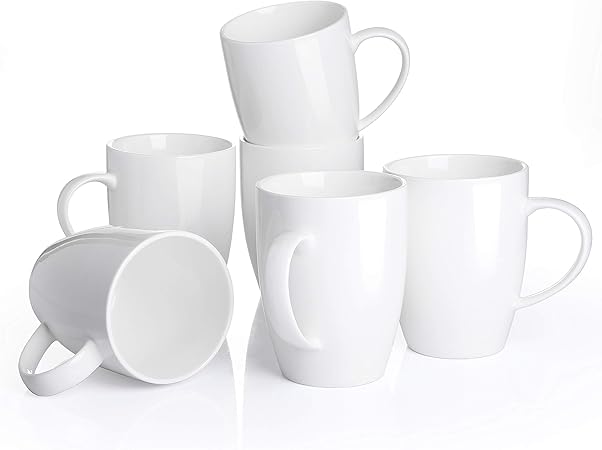
Find the location of `cup handles`. cup handles is located at coordinates (61, 374), (66, 203), (281, 296), (579, 269), (403, 69).